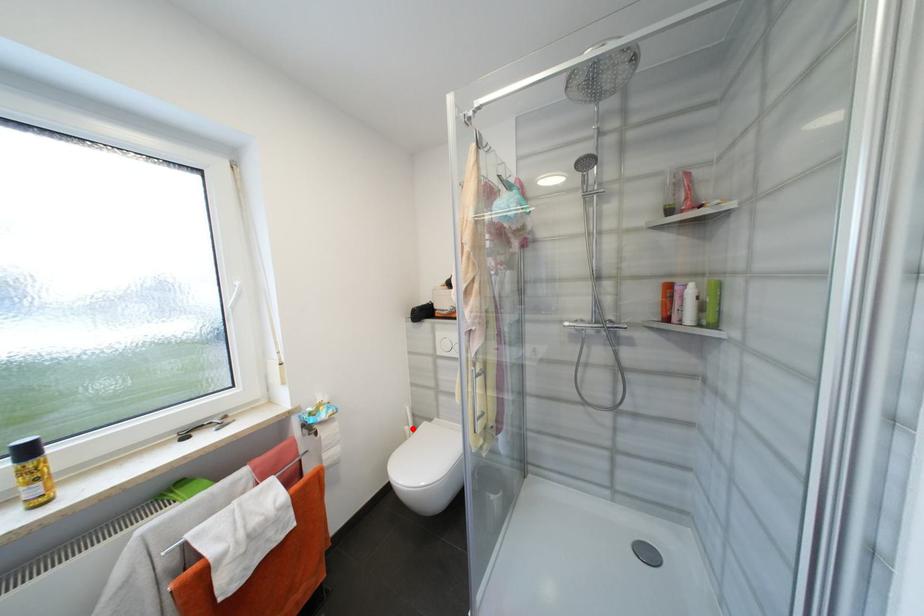
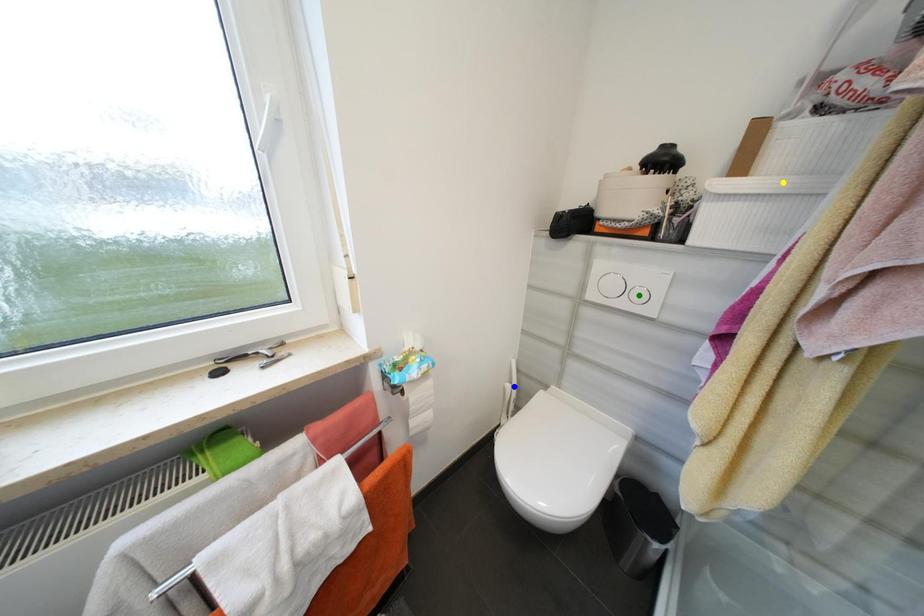
Question: I am providing you with two images of the same scene from different viewpoints. A red point is marked on the first image. You are given multiple points on the second image. In image 2, which mark is for the same physical point as the one in image 1?

Choices:
 (A) yellow point
 (B) blue point
 (C) green point

Answer: (B)